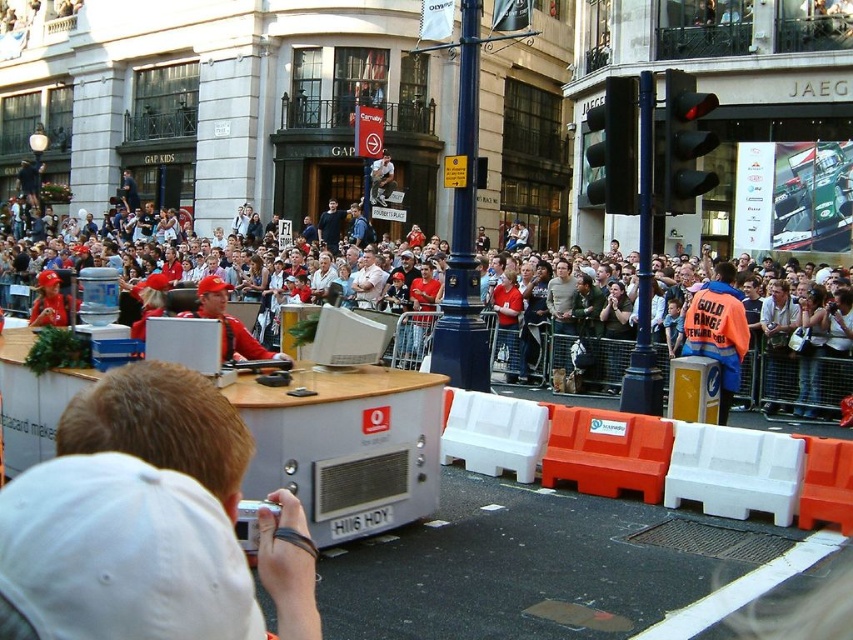
Question: Which object is farther from the camera taking this photo?

Choices:
 (A) orange reflective jacket at center
 (B) dark blue shirt at center

Answer: (B)

Question: Which object appears closest to the camera in this image?

Choices:
 (A) matte red shirts at center
 (B) dark blue shirt at center
 (C) orange reflective jacket at center

Answer: (A)

Question: Which object appears closest to the camera in this image?

Choices:
 (A) dark blue shirt at center
 (B) matte red shirts at center
 (C) orange reflective jacket at center

Answer: (B)

Question: Does orange reflective jacket at center appear over dark blue shirt at center?

Choices:
 (A) yes
 (B) no

Answer: (B)

Question: Does orange reflective jacket at center have a lesser width compared to dark blue shirt at center?

Choices:
 (A) no
 (B) yes

Answer: (A)

Question: Is orange reflective jacket at center positioned before dark blue shirt at center?

Choices:
 (A) yes
 (B) no

Answer: (A)